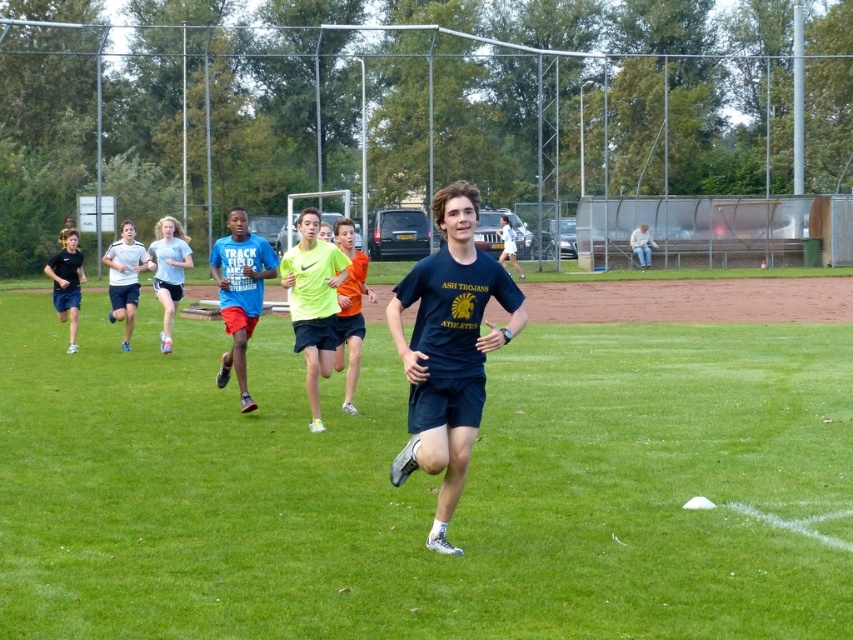
Does dark blue athletic wear at center have a larger size compared to light blue jersey at center?

Actually, dark blue athletic wear at center might be smaller than light blue jersey at center.

Is point (486, 280) positioned in front of point (164, 280)?

Yes, point (486, 280) is in front of point (164, 280).

The width and height of the screenshot is (853, 640). What do you see at coordinates (448, 349) in the screenshot?
I see `dark blue athletic wear at center` at bounding box center [448, 349].

Find the location of `dark blue athletic wear at center`. dark blue athletic wear at center is located at coordinates (448, 349).

Which is below, matte blue t-shirt at center or light blue athletic shorts at left?

matte blue t-shirt at center

Does point (252, 260) come farther from viewer compared to point (132, 280)?

That is False.

Between point (225, 324) and point (126, 333), which one is positioned behind?

The point (126, 333) is behind.

Find the location of `matte blue t-shirt at center`. matte blue t-shirt at center is located at coordinates (241, 292).

Can you confirm if neon yellow shirt at center is bigger than light blue jersey at center?

Actually, neon yellow shirt at center might be smaller than light blue jersey at center.

Is neon yellow shirt at center taller than light blue jersey at center?

Yes, neon yellow shirt at center is taller than light blue jersey at center.

Is point (334, 312) positioned behind point (169, 321)?

No, it is in front of (169, 321).

Identify the location of neon yellow shirt at center. (312, 301).